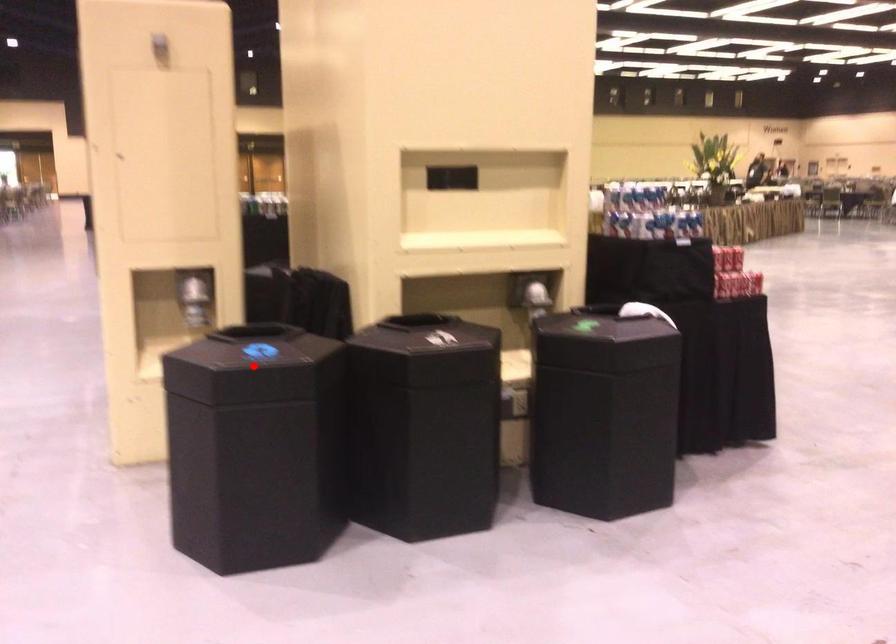
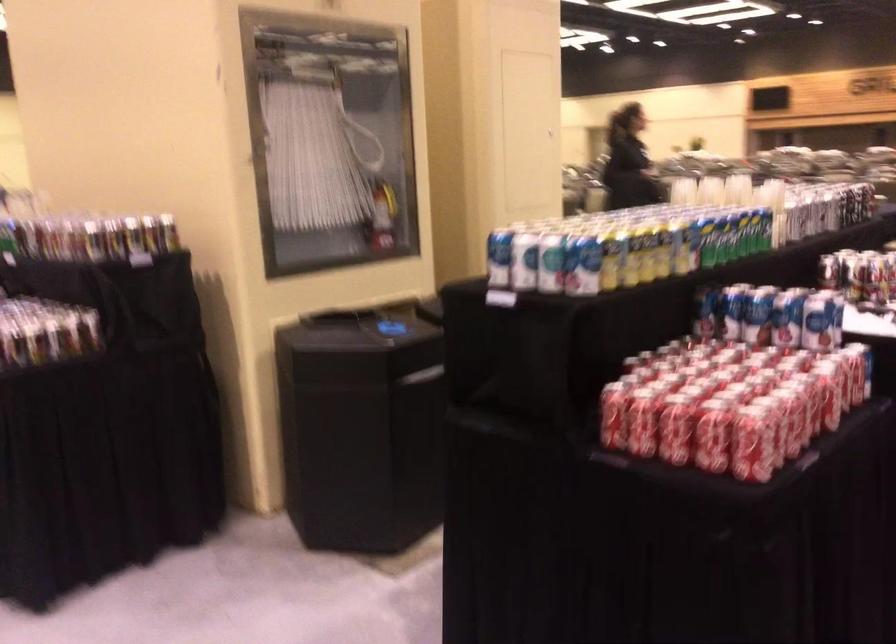
Question: I am providing you with two images of the same scene from different viewpoints. A red point is marked on the first image. Is the red point's position out of view in image 2?

Choices:
 (A) Yes
 (B) No

Answer: (A)